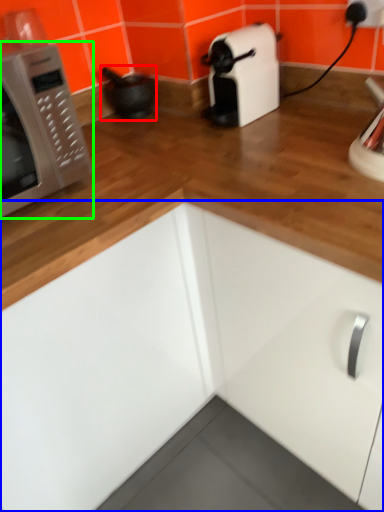
Question: Estimate the real-world distances between objects in this image. Which object is closer to appliance (highlighted by a red box), cabinetry (highlighted by a blue box) or microwave oven (highlighted by a green box)?

Choices:
 (A) cabinetry
 (B) microwave oven

Answer: (B)